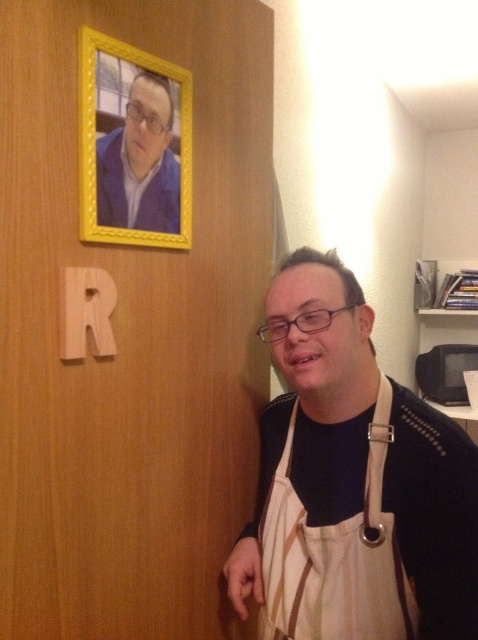
Question: Which object is closer to the camera taking this photo?

Choices:
 (A) beige apron at right
 (B) yellow wood picture frame at upper left

Answer: (A)

Question: Considering the relative positions of beige canvas apron at lower right and yellow wood picture frame at upper left in the image provided, where is beige canvas apron at lower right located with respect to yellow wood picture frame at upper left?

Choices:
 (A) right
 (B) left

Answer: (A)

Question: Can you confirm if beige apron at right is wider than beige canvas apron at lower right?

Choices:
 (A) yes
 (B) no

Answer: (A)

Question: Which point appears farthest from the camera in this image?

Choices:
 (A) (305, 380)
 (B) (184, 72)
 (C) (380, 580)

Answer: (B)

Question: Which of the following is the closest to the observer?

Choices:
 (A) (291, 442)
 (B) (296, 593)
 (C) (111, 56)

Answer: (C)

Question: Can you confirm if beige canvas apron at lower right is thinner than yellow wood picture frame at upper left?

Choices:
 (A) yes
 (B) no

Answer: (B)